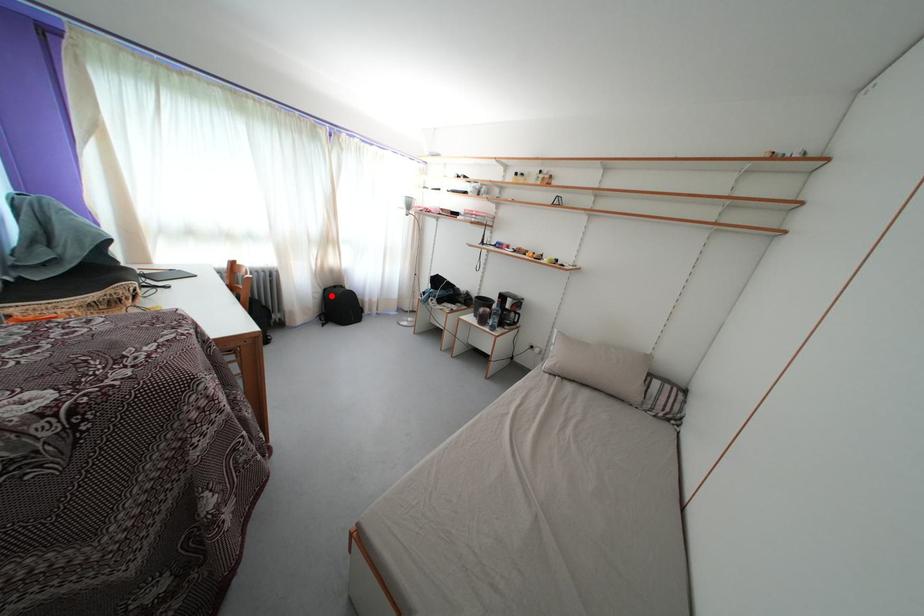
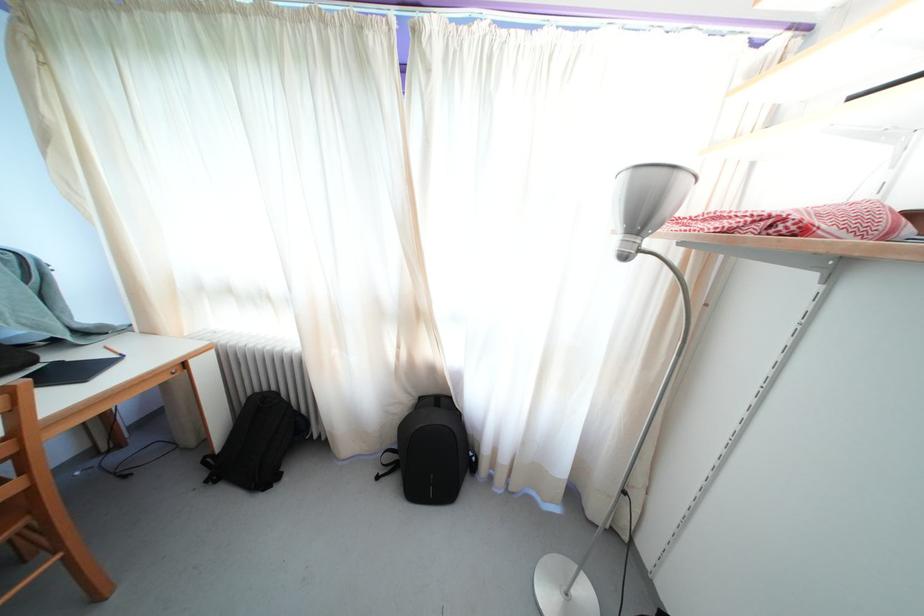
The point at the highlighted location is marked in the first image. Where is the corresponding point in the second image?

(427, 405)